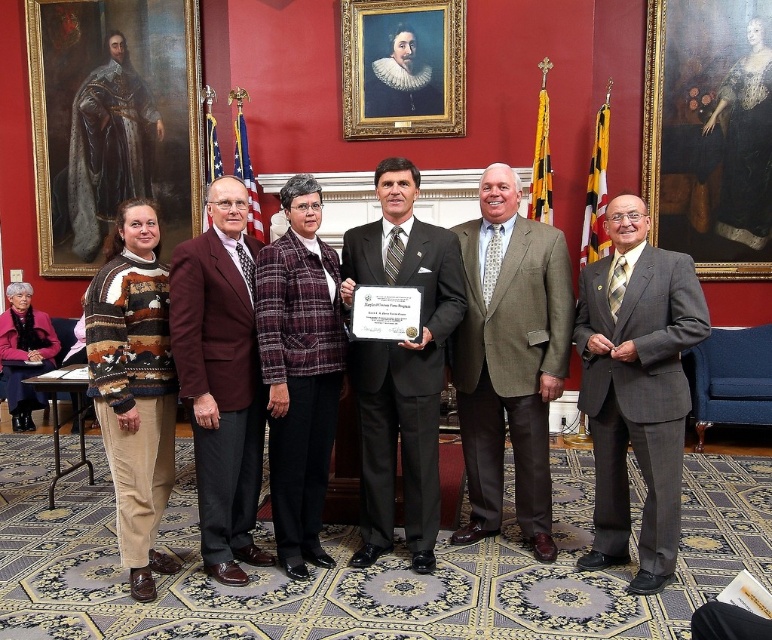
Question: Does plaid fabric jacket at center appear on the left side of goldwooden frame at upper center?

Choices:
 (A) yes
 (B) no

Answer: (A)

Question: Which of the following is the farthest from the observer?

Choices:
 (A) black suit at center
 (B) gray suit at center
 (C) gold-framed portrait at upper right

Answer: (C)

Question: Does plaid fabric jacket at center have a greater width compared to goldwooden frame at upper center?

Choices:
 (A) yes
 (B) no

Answer: (B)

Question: From the image, what is the correct spatial relationship of black suit at center in relation to maroon wool suit at left?

Choices:
 (A) above
 (B) below

Answer: (A)

Question: Which point is farther to the camera?

Choices:
 (A) black suit at center
 (B) brown wool suit at center
 (C) gold-framed portrait at upper right

Answer: (C)

Question: Which is farther from the maroon wool suit at left?

Choices:
 (A) brown wool suit at center
 (B) gray suit at center

Answer: (B)